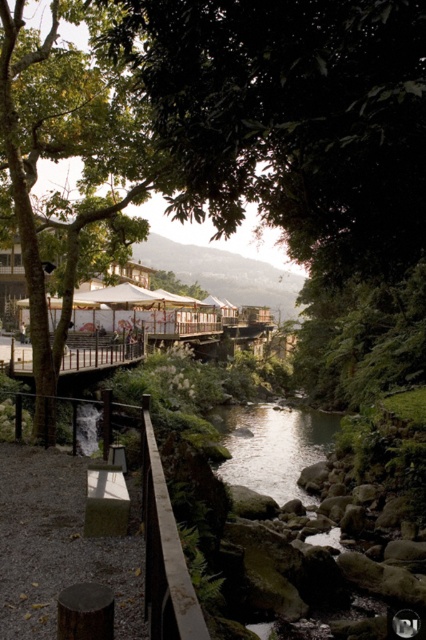
Question: Can you confirm if green leafy tree at center is positioned to the right of brown wooden rail at lower left?

Choices:
 (A) no
 (B) yes

Answer: (B)

Question: Among these points, which one is farthest from the camera?

Choices:
 (A) (241, 116)
 (B) (160, 541)

Answer: (A)

Question: Can you confirm if green leafy tree at center is smaller than brown wooden rail at lower left?

Choices:
 (A) yes
 (B) no

Answer: (B)

Question: Among these objects, which one is farthest from the camera?

Choices:
 (A) brown wooden rail at lower left
 (B) green leafy tree at center

Answer: (A)

Question: Can you confirm if green leafy tree at center is positioned below brown wooden rail at lower left?

Choices:
 (A) yes
 (B) no

Answer: (B)